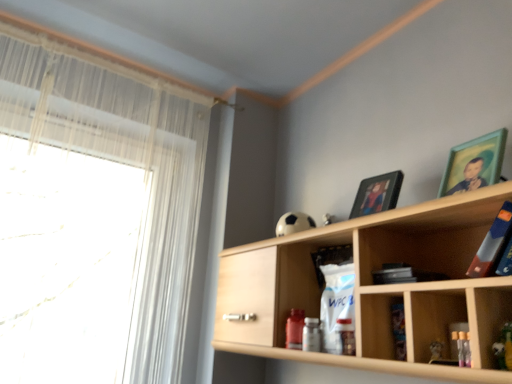
Question: In terms of height, does hardcover book at upper right look taller or shorter compared to green matte picture frame at upper right, arranged as the first picture frame when viewed from the right?

Choices:
 (A) short
 (B) tall

Answer: (A)

Question: Is hardcover book at upper right to the left or to the right of green matte picture frame at upper right, the 1th picture frame from the front, in the image?

Choices:
 (A) right
 (B) left

Answer: (A)

Question: Considering the real-world distances, which object is farthest from the matte black picture frame at upper center, the 1th picture frame from the left?

Choices:
 (A) hardcover book at upper right
 (B) green matte picture frame at upper right, the 1th picture frame from the front
 (C) wooden shelf at upper right
 (D) white sheer curtain at left

Answer: (D)

Question: Which object is the closest to the green matte picture frame at upper right, the 1th picture frame from the front?

Choices:
 (A) wooden shelf at upper right
 (B) white sheer curtain at left
 (C) hardcover book at upper right
 (D) matte black picture frame at upper center, which is the second picture frame in front-to-back order

Answer: (C)